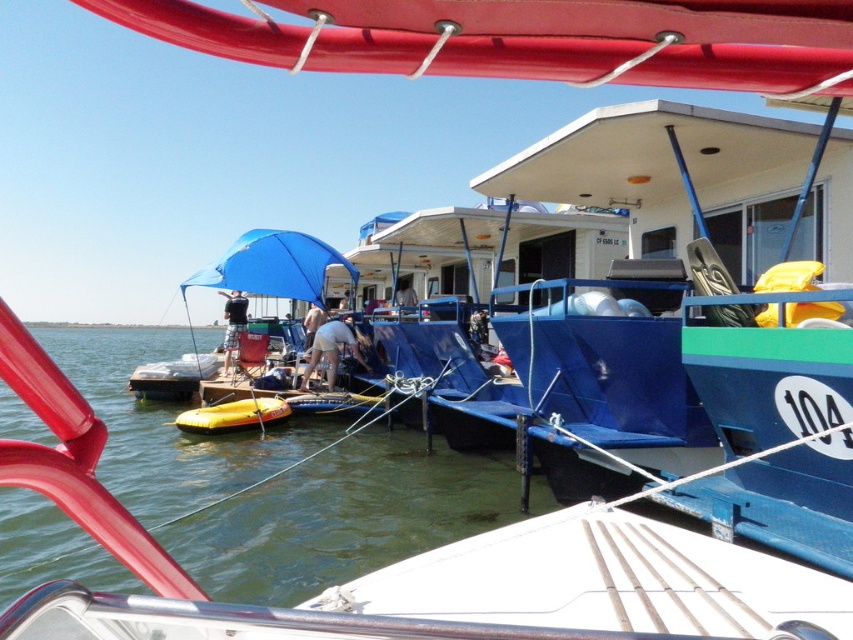
You are standing on the dock and want to reach the blue fabric umbrella at left without stepping into the green water at lower left. Is this possible?

The green water at lower left is in front of the blue fabric umbrella at left, so you would have to step over or around the green water at lower left to reach the blue fabric umbrella at left. Since you cannot step into the water, you might need to find another path around it.

You are standing on the dock and want to place a 1.2 meter wide box between the green water at lower left and the blue fabric umbrella at left. Can the box fit there?

The green water at lower left might be wider than blue fabric umbrella at left, so the box could potentially fit if the space between them is at least 1.2 meters. However, since the exact width isn t specified, it s uncertain.